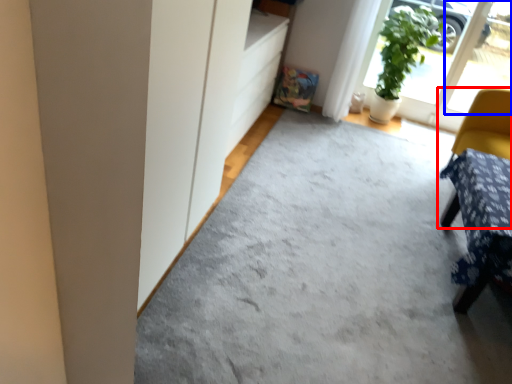
Question: Which object is closer to the camera taking this photo, chair (highlighted by a red box) or window (highlighted by a blue box)?

Choices:
 (A) chair
 (B) window

Answer: (A)